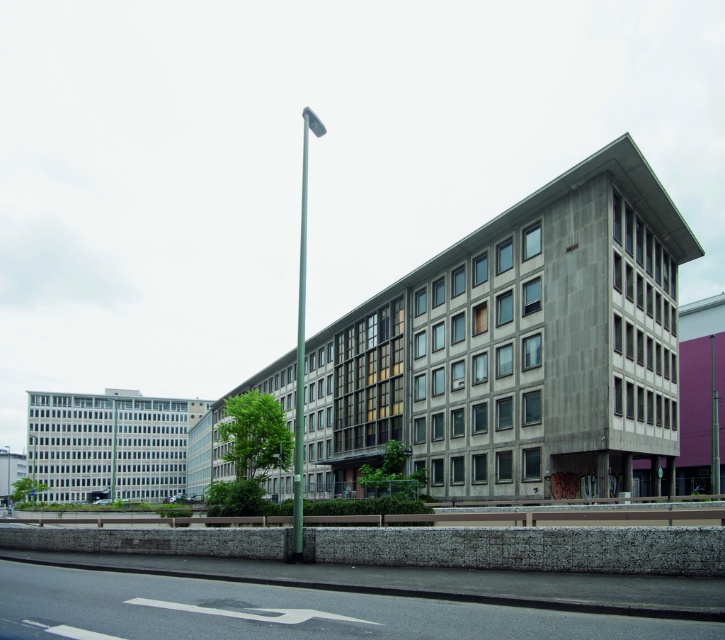
Question: Is green metallic pole at center thinner than silver metallic pole at center?

Choices:
 (A) no
 (B) yes

Answer: (A)

Question: Which of the following is the closest to the observer?

Choices:
 (A) silver metallic pole at center
 (B) green metallic pole at center

Answer: (A)

Question: Where is green metallic pole at center located in relation to silver metallic pole at center in the image?

Choices:
 (A) left
 (B) right

Answer: (B)

Question: Which point is closer to the camera?

Choices:
 (A) green metallic pole at center
 (B) silver metallic pole at center

Answer: (B)

Question: From the image, what is the correct spatial relationship of green metallic pole at center in relation to silver metallic pole at center?

Choices:
 (A) below
 (B) above

Answer: (B)